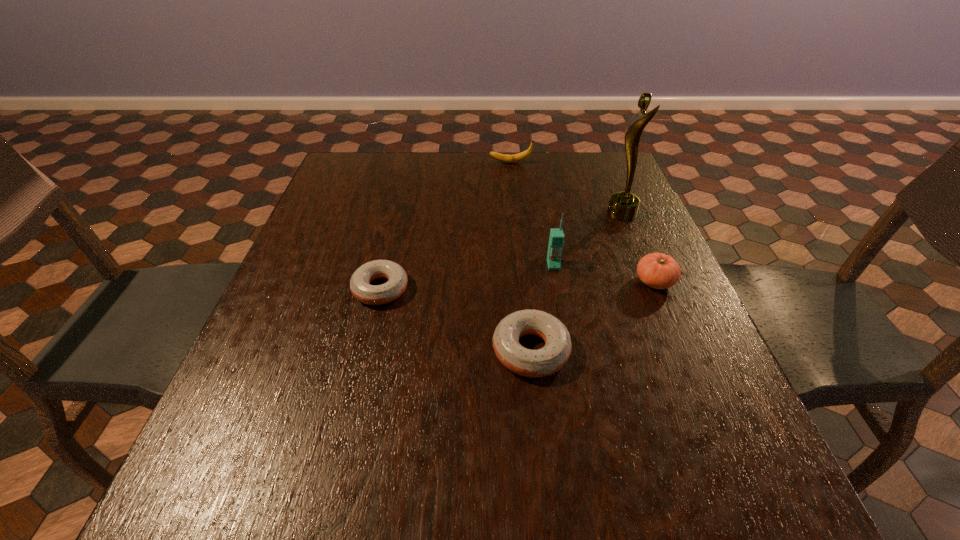
Locate an element on the screen. The width and height of the screenshot is (960, 540). vacant space situated 0.070m on the back of the taller doughnut is located at coordinates (525, 296).

The image size is (960, 540). In order to click on vacant region located 0.360m on the peel of the farthest object from the top in this screenshot , I will do `click(374, 163)`.

Locate an element on the screen. The width and height of the screenshot is (960, 540). vacant space located 0.080m on the peel of the farthest object from the top is located at coordinates (463, 163).

At what (x,y) coordinates should I click in order to perform the action: click on free location located 0.210m on the peel of the farthest object from the top. Please return your answer as a coordinate pair (x, y). This screenshot has width=960, height=540. Looking at the image, I should click on (421, 163).

I want to click on vacant space located 0.070m on the front of the tomato, so click(671, 320).

This screenshot has width=960, height=540. Identify the location of vacant area situated 0.140m on the keypad of the cellular telephone. (563, 316).

The height and width of the screenshot is (540, 960). I want to click on free space located 0.350m on the front-facing side of the award, so [477, 214].

Where is `free point located on the front-facing side of the award`? The height and width of the screenshot is (540, 960). free point located on the front-facing side of the award is located at coordinates (481, 214).

This screenshot has width=960, height=540. Find the location of `free location located 0.220m on the front-facing side of the award`. free location located 0.220m on the front-facing side of the award is located at coordinates (525, 214).

You are a GUI agent. You are given a task and a screenshot of the screen. Output one action in this format:
    pyautogui.click(x=<x>, y=<y>)
    Task: Click on the object positioned at the far edge
    
    Given the screenshot: What is the action you would take?
    pyautogui.click(x=515, y=158)